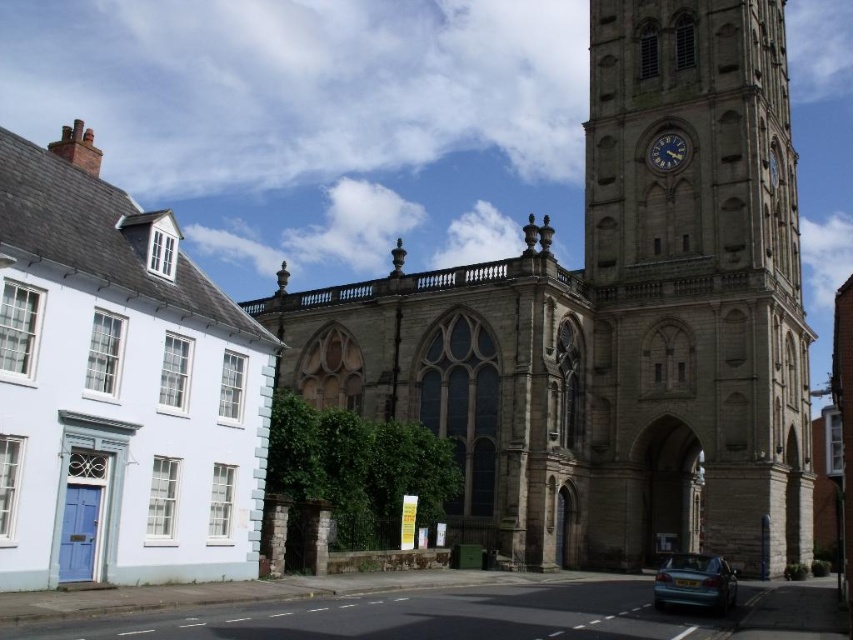
You are a pedestrian standing at the intersection in front of the teal matte car at lower right and the metallic clock face at upper center. Which object is positioned higher in the image?

The metallic clock face at upper center is positioned higher in the image than the teal matte car at lower right.